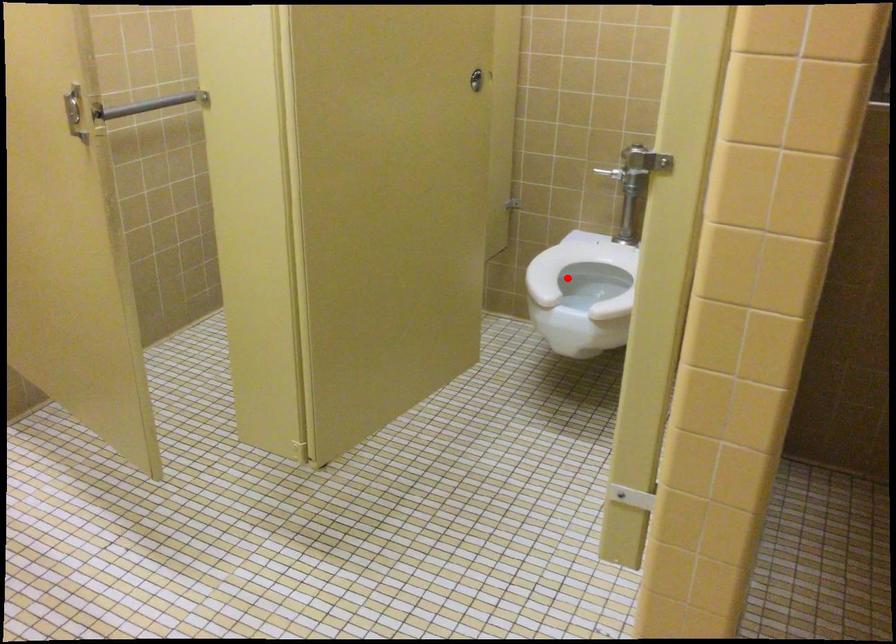
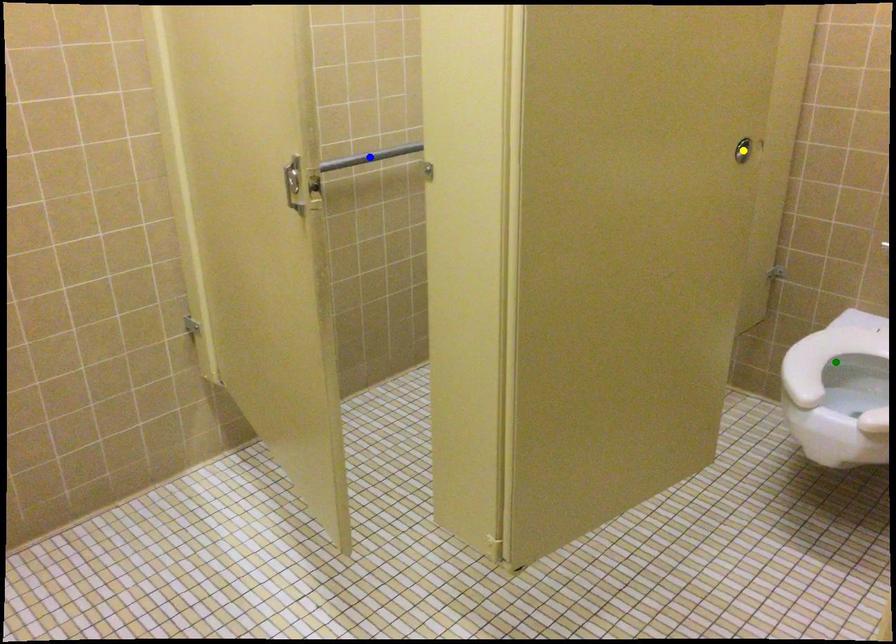
Question: I am providing you with two images of the same scene from different viewpoints. A red point is marked on the first image. You are given multiple points on the second image. In image 2, which mark is for the same physical point as the one in image 1?

Choices:
 (A) blue point
 (B) green point
 (C) yellow point

Answer: (B)